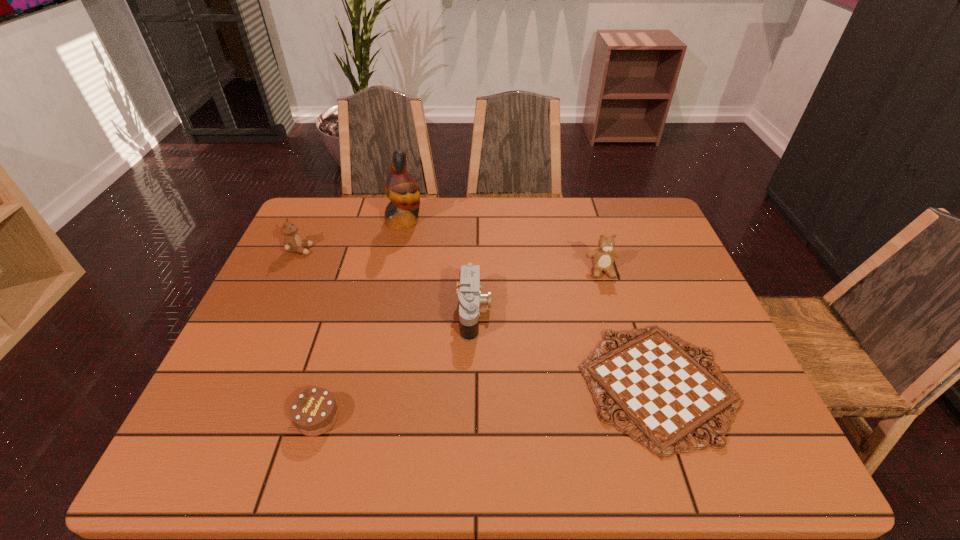
Where is `the tallest object`? This screenshot has height=540, width=960. the tallest object is located at coordinates (403, 191).

This screenshot has width=960, height=540. Find the location of `the farthest object`. the farthest object is located at coordinates (403, 191).

Locate an element on the screen. The height and width of the screenshot is (540, 960). the fourth nearest object is located at coordinates (602, 258).

You are a GUI agent. You are given a task and a screenshot of the screen. Output one action in this format:
    pyautogui.click(x=<x>, y=<y>)
    Task: Click on the nearer teddy bear
    
    Given the screenshot: What is the action you would take?
    pyautogui.click(x=602, y=258)

At what (x,y) coordinates should I click in order to perform the action: click on the farther teddy bear. Please return your answer as a coordinate pair (x, y). Looking at the image, I should click on (292, 242).

You are a GUI agent. You are given a task and a screenshot of the screen. Output one action in this format:
    pyautogui.click(x=<x>, y=<y>)
    Task: Click on the left teddy bear
    Image resolution: width=960 pixels, height=540 pixels.
    Given the screenshot: What is the action you would take?
    pyautogui.click(x=292, y=242)

Where is `camera`? This screenshot has width=960, height=540. camera is located at coordinates (470, 297).

You are a GUI agent. You are given a task and a screenshot of the screen. Output one action in this format:
    pyautogui.click(x=<x>, y=<y>)
    Task: Click on the fourth object from left to right
    This screenshot has width=960, height=540.
    Given the screenshot: What is the action you would take?
    pyautogui.click(x=470, y=297)

At what (x,y) coordinates should I click in order to perform the action: click on the second shortest object. Please return your answer as a coordinate pair (x, y). Image resolution: width=960 pixels, height=540 pixels. Looking at the image, I should click on (314, 412).

Locate an element on the screen. The width and height of the screenshot is (960, 540). chessboard is located at coordinates (667, 395).